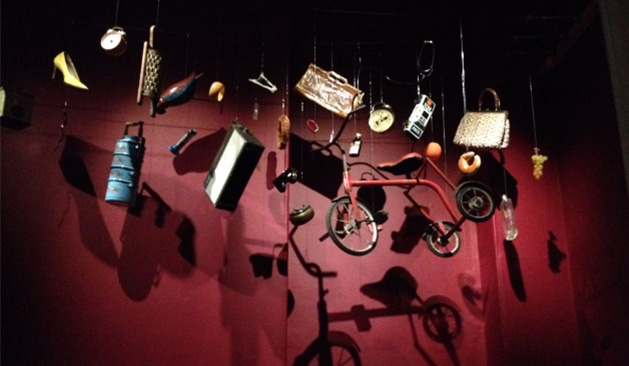
Identify the location of handle. (355, 110).